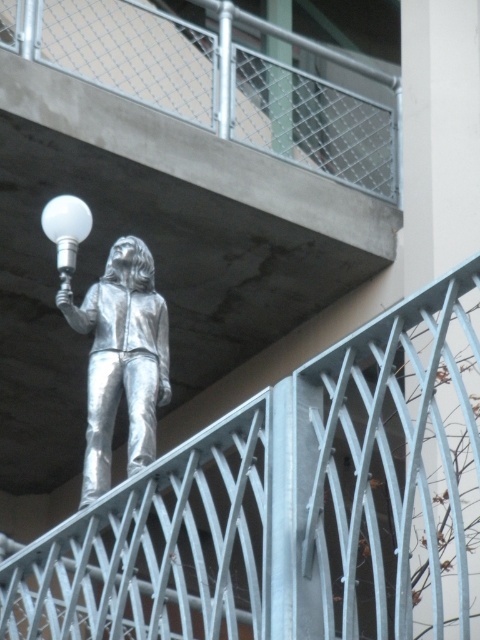
You are an architect designing a new sculpture garden and want to place a 3D model of the shiny silver figure at upper center on top of the brushed metal railing at upper center. Based on the image, will the figure fit vertically on the railing without exceeding its height?

The brushed metal railing at upper center is much taller than the shiny silver figure at upper center, so placing the figure on top would leave sufficient vertical space, allowing it to fit without exceeding the railing height.

You are a drone operator trying to navigate a drone through a specific point in the scene. The drone must pass through the exact location of the brushed metal railing at upper center. What are the coordinates of the point where the drone should aim?

The coordinates of the brushed metal railing at upper center are at point (292, 506), so the drone should aim for those coordinates to reach the exact location.

You are a drone operator trying to navigate a small drone between two points in the image. The first point is point (104, 435) and the second point is point (54, 228). Since the drone can only move forward and backward, which point should you start from to ensure the drone can reach the other point without needing to turn sideways?

You should start from point (54, 228) because it is further away from the viewer than point (104, 435). Since the drone can only move forward and backward, starting from the further point allows it to move toward the closer point without needing to turn sideways.